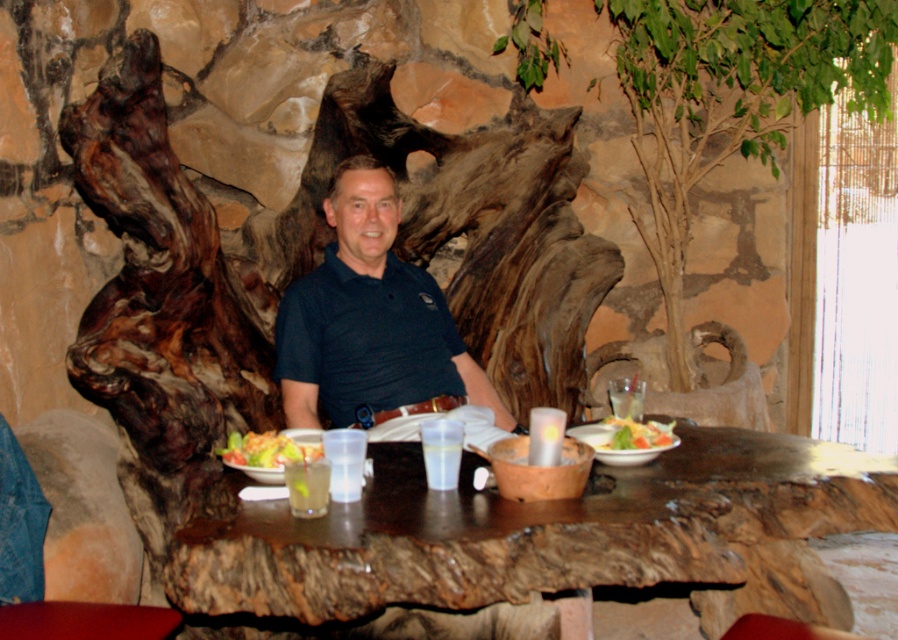
Does green leafy tree at upper center have a lesser height compared to dark blue polo shirt at center?

In fact, green leafy tree at upper center may be taller than dark blue polo shirt at center.

Which is above, green leafy tree at upper center or dark blue polo shirt at center?

Positioned higher is green leafy tree at upper center.

Is point (710, 145) closer to viewer compared to point (419, 280)?

That is False.

Image resolution: width=898 pixels, height=640 pixels. I want to click on green leafy tree at upper center, so click(x=731, y=99).

Based on the photo, between shiny plastic salad bowl at center and fresh salad at center, which one is positioned higher?

fresh salad at center

Is shiny plastic salad bowl at center closer to camera compared to fresh salad at center?

Yes.

Which is behind, point (270, 456) or point (663, 432)?

The point (663, 432) is behind.

The image size is (898, 640). What are the coordinates of `shiny plastic salad bowl at center` in the screenshot? It's located at tap(270, 449).

Is brown rough wood tree trunk at center to the left of dark blue cotton polo shirt at center from the viewer's perspective?

Indeed, brown rough wood tree trunk at center is positioned on the left side of dark blue cotton polo shirt at center.

Is brown rough wood tree trunk at center below dark blue cotton polo shirt at center?

Incorrect, brown rough wood tree trunk at center is not positioned below dark blue cotton polo shirt at center.

Is point (509, 170) in front of point (410, 304)?

No, (509, 170) is behind (410, 304).

In order to click on brown rough wood tree trunk at center in this screenshot , I will do `click(309, 264)`.